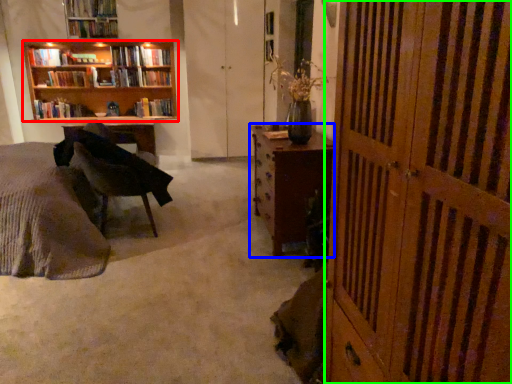
Question: Which object is positioned closest to bookcase (highlighted by a red box)? Select from desk (highlighted by a blue box) and screen door (highlighted by a green box).

Choices:
 (A) desk
 (B) screen door

Answer: (A)